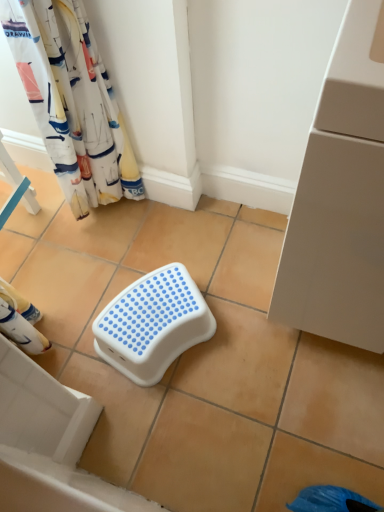
At what (x,y) coordinates should I click in order to perform the action: click on free point to the left of white fabric curtain at upper left. Please return your answer as a coordinate pair (x, y). The height and width of the screenshot is (512, 384). Looking at the image, I should click on (57, 220).